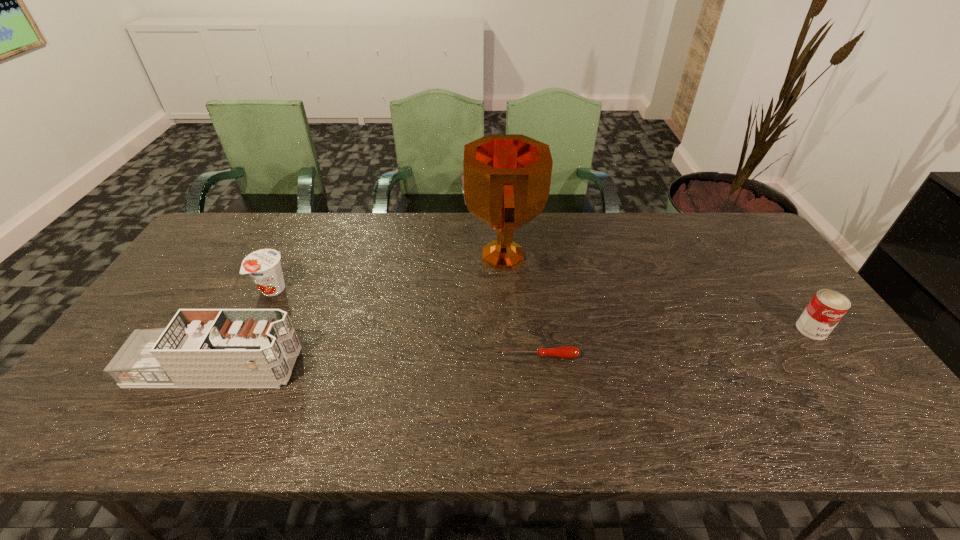
You are a GUI agent. You are given a task and a screenshot of the screen. Output one action in this format:
    pyautogui.click(x=<x>, y=<y>)
    Task: Click on the unoccupied position between the shortest object and the award
    This screenshot has height=540, width=960.
    Given the screenshot: What is the action you would take?
    click(x=519, y=306)

The width and height of the screenshot is (960, 540). I want to click on free space between the tallest object and the dollhouse, so [358, 312].

This screenshot has height=540, width=960. In order to click on vacant region between the award and the second tallest object in this screenshot , I will do `click(358, 312)`.

Image resolution: width=960 pixels, height=540 pixels. What are the coordinates of `empty space that is in between the tallest object and the screwdriver` in the screenshot? It's located at (519, 306).

Find the location of a particular element. The width and height of the screenshot is (960, 540). vacant space that is in between the second tallest object and the shortest object is located at coordinates click(x=376, y=362).

This screenshot has height=540, width=960. I want to click on free space between the screwdriver and the fourth shortest object, so click(x=376, y=362).

Where is `vacant area that lies between the dollhouse and the rightmost object`? The height and width of the screenshot is (540, 960). vacant area that lies between the dollhouse and the rightmost object is located at coordinates (514, 348).

Identify which object is the closest to the fourth shortest object. Please provide its 2D coordinates. Your answer should be formatted as a tuple, i.e. [(x, y)], where the tuple contains the x and y coordinates of a point satisfying the conditions above.

[(264, 266)]

Identify which object is the third closest to the shortest object. Please provide its 2D coordinates. Your answer should be formatted as a tuple, i.e. [(x, y)], where the tuple contains the x and y coordinates of a point satisfying the conditions above.

[(827, 307)]

At what (x,y) coordinates should I click in order to perform the action: click on vacant position in the image that satisfies the following two spatial constraints: 1. on the side of the screwdriver with the star emblem; 2. on the left side of the tallest object. Please return your answer as a coordinate pair (x, y). The width and height of the screenshot is (960, 540). Looking at the image, I should click on (507, 356).